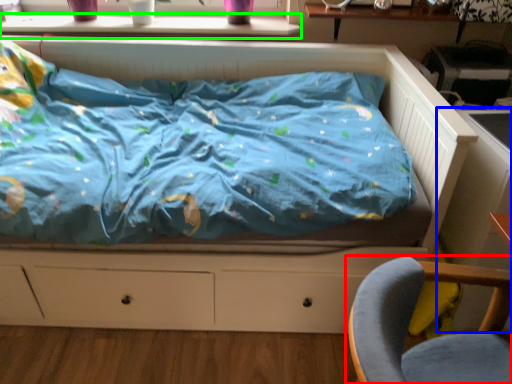
Question: Considering the real-world distances, which object is farthest from chair (highlighted by a red box)? table (highlighted by a blue box) or window sill (highlighted by a green box)?

Choices:
 (A) table
 (B) window sill

Answer: (B)